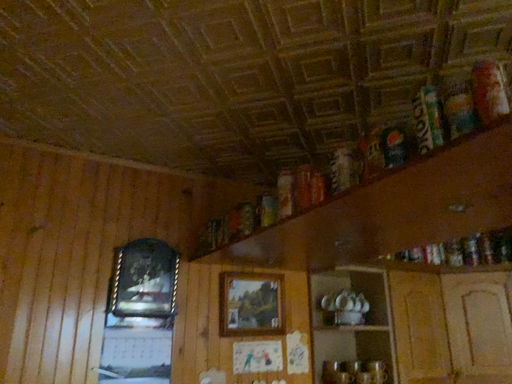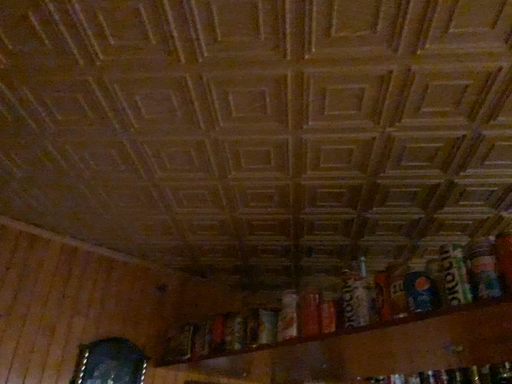
Question: How did the camera likely rotate when shooting the video?

Choices:
 (A) rotated upward
 (B) rotated downward

Answer: (A)